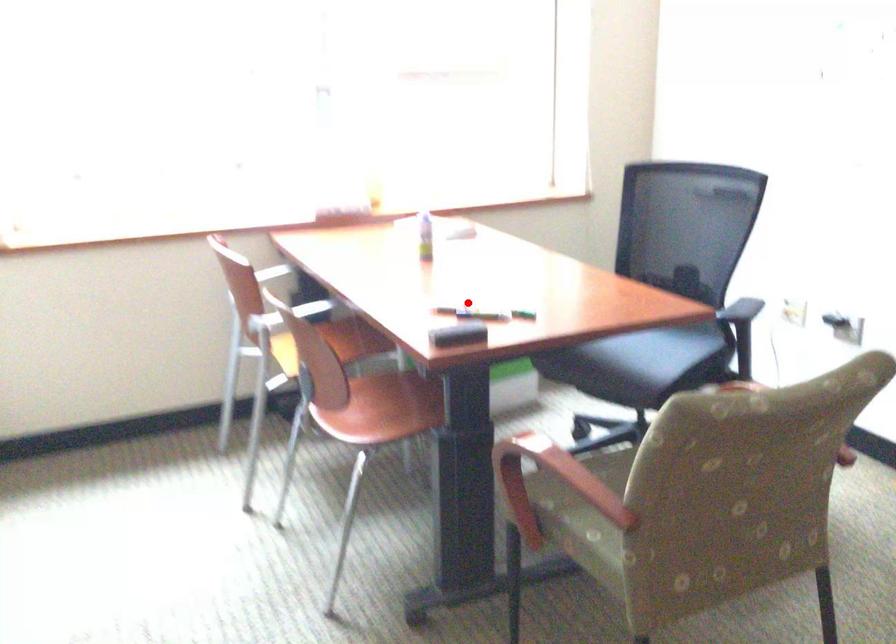
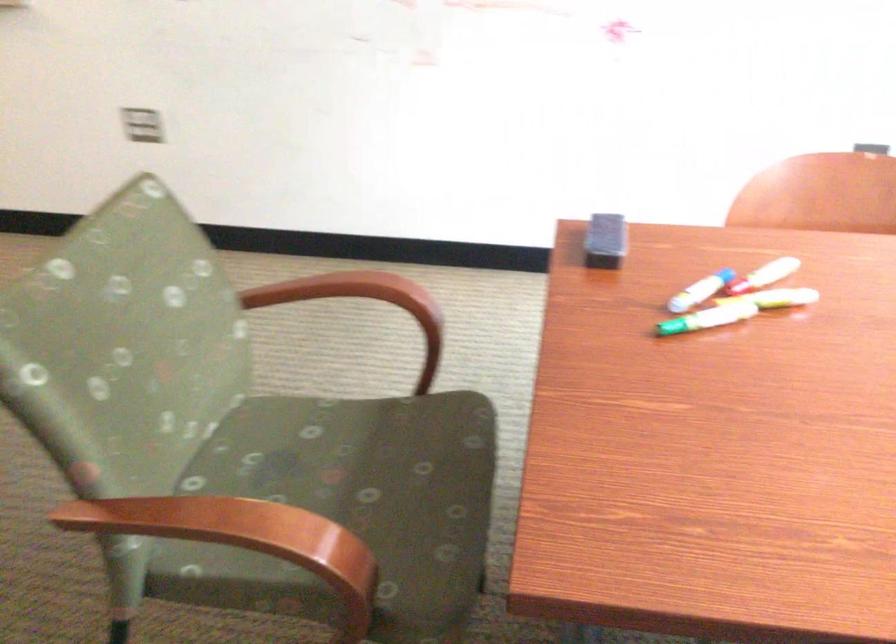
Locate, in the second image, the point that corresponds to the highlighted location in the first image.

(776, 298)